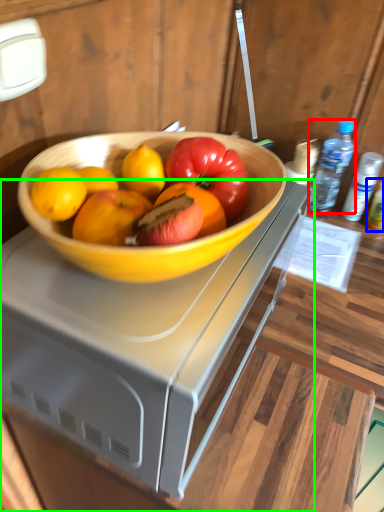
Question: Which object is positioned closest to bottle (highlighted by a red box)? Select from bottle (highlighted by a blue box) and desk (highlighted by a green box).

Choices:
 (A) bottle
 (B) desk

Answer: (A)